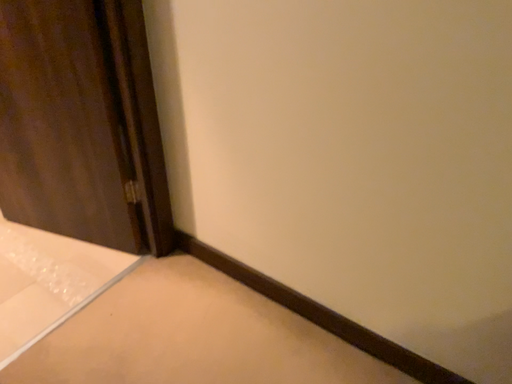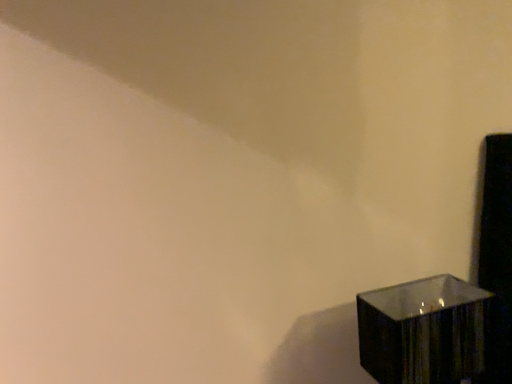
Question: Which way did the camera rotate in the video?

Choices:
 (A) rotated downward
 (B) rotated upward

Answer: (B)